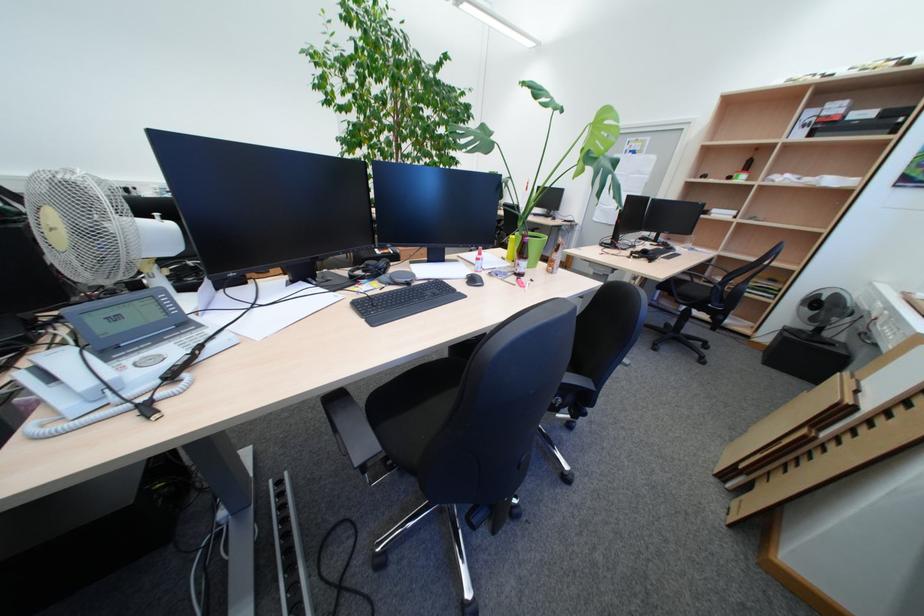
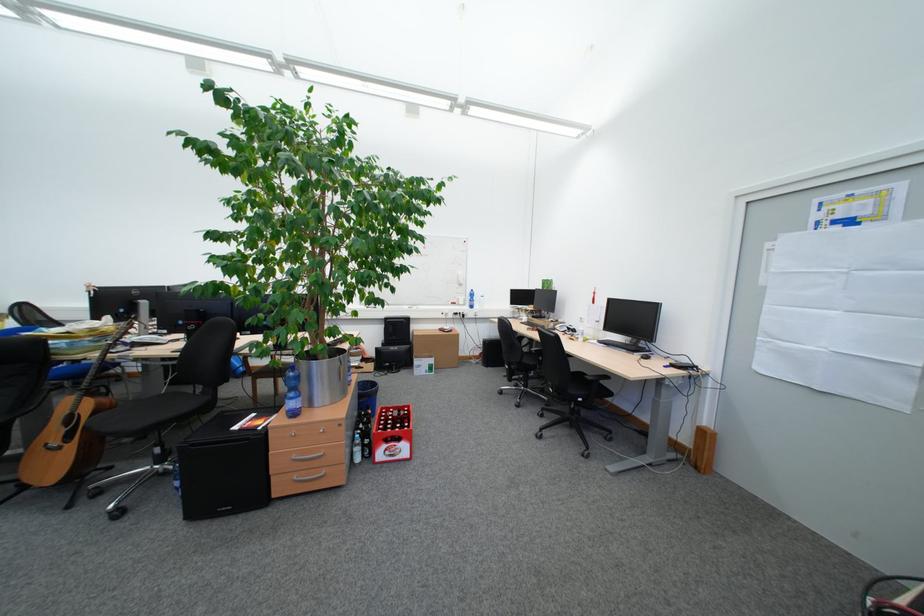
Locate, in the second image, the point that corresponds to pixel 561 220 in the first image.

(648, 357)